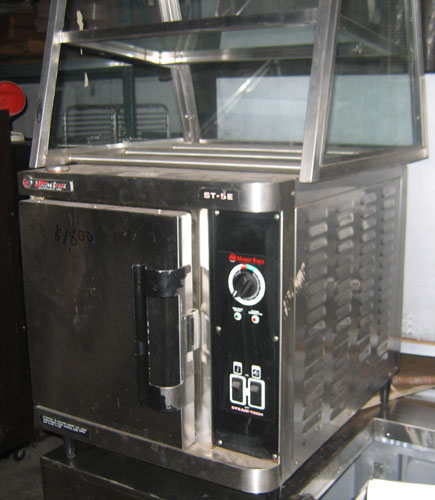
Where is `door handle`? The image size is (435, 500). door handle is located at coordinates (141, 347), (137, 270), (164, 400), (171, 281).